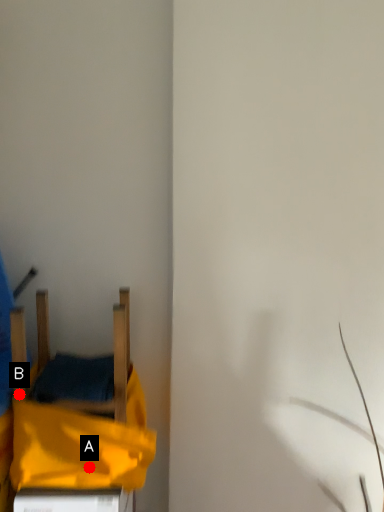
Question: Two points are circled on the image, labeled by A and B beside each circle. Which point is closer to the camera?

Choices:
 (A) A is closer
 (B) B is closer

Answer: (B)